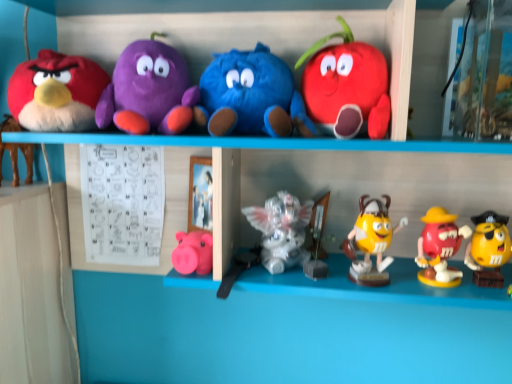
Question: Is matte pink piggy bank at lower center, which is the 7th toy in right-to-left order, facing towards brown plush toy at left, which ranks as the 10th toy in right-to-left order?

Choices:
 (A) no
 (B) yes

Answer: (A)

Question: Can you confirm if matte pink piggy bank at lower center, which is the 7th toy in right-to-left order, is taller than brown plush toy at left, which ranks as the 10th toy in right-to-left order?

Choices:
 (A) yes
 (B) no

Answer: (B)

Question: Does matte pink piggy bank at lower center, which is the 7th toy in right-to-left order, have a greater width compared to brown plush toy at left, which ranks as the 10th toy in right-to-left order?

Choices:
 (A) no
 (B) yes

Answer: (A)

Question: Is matte pink piggy bank at lower center, which appears as the fourth toy when viewed from the left, turned away from brown plush toy at left, which ranks as the 10th toy in right-to-left order?

Choices:
 (A) yes
 (B) no

Answer: (B)

Question: From the image's perspective, does matte pink piggy bank at lower center, which is the 7th toy in right-to-left order, appear lower than brown plush toy at left, which ranks as the 10th toy in right-to-left order?

Choices:
 (A) yes
 (B) no

Answer: (A)

Question: In the image, is rubberized red m&m figure at lower right, placed as the second toy when sorted from right to left, on the left side or the right side of yellow glossy m&m figure at center, acting as the third toy starting from the right?

Choices:
 (A) left
 (B) right

Answer: (B)

Question: Is point (454, 228) positioned closer to the camera than point (385, 218)?

Choices:
 (A) farther
 (B) closer

Answer: (A)

Question: From a real-world perspective, is rubberized red m&m figure at lower right, which is the ninth toy in left-to-right order, above or below yellow glossy m&m figure at center, arranged as the 8th toy when viewed from the left?

Choices:
 (A) above
 (B) below

Answer: (B)

Question: From the image's perspective, is rubberized red m&m figure at lower right, placed as the second toy when sorted from right to left, located above or below yellow glossy m&m figure at center, arranged as the 8th toy when viewed from the left?

Choices:
 (A) above
 (B) below

Answer: (B)

Question: Considering the positions of brown plush toy at left, the 1th toy from the left, and purple plush toy at upper left, the third toy viewed from the left, in the image, is brown plush toy at left, the 1th toy from the left, wider or thinner than purple plush toy at upper left, the third toy viewed from the left,?

Choices:
 (A) thin
 (B) wide

Answer: (A)

Question: From a real-world perspective, is brown plush toy at left, which ranks as the 10th toy in right-to-left order, above or below purple plush toy at upper left, the third toy viewed from the left?

Choices:
 (A) above
 (B) below

Answer: (B)

Question: From the image's perspective, is brown plush toy at left, the 1th toy from the left, located above or below purple plush toy at upper left, which appears as the eighth toy when viewed from the right?

Choices:
 (A) above
 (B) below

Answer: (B)

Question: Is brown plush toy at left, the 1th toy from the left, situated inside purple plush toy at upper left, which appears as the eighth toy when viewed from the right, or outside?

Choices:
 (A) outside
 (B) inside

Answer: (A)

Question: Looking at their shapes, would you say yellow glossy m&m figure at center, arranged as the 8th toy when viewed from the left, is wider or thinner than blue plush toy at center, the 6th toy viewed from the right?

Choices:
 (A) wide
 (B) thin

Answer: (B)

Question: Would you say yellow glossy m&m figure at center, arranged as the 8th toy when viewed from the left, is to the left or to the right of blue plush toy at center, positioned as the 5th toy in left-to-right order, in the picture?

Choices:
 (A) right
 (B) left

Answer: (A)